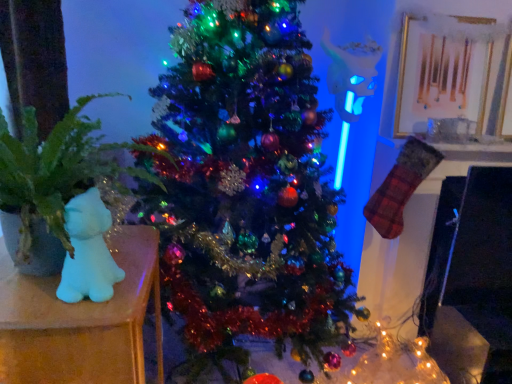
Where is `vacant space to the left of white matte plush cat at left`? The height and width of the screenshot is (384, 512). vacant space to the left of white matte plush cat at left is located at coordinates (32, 282).